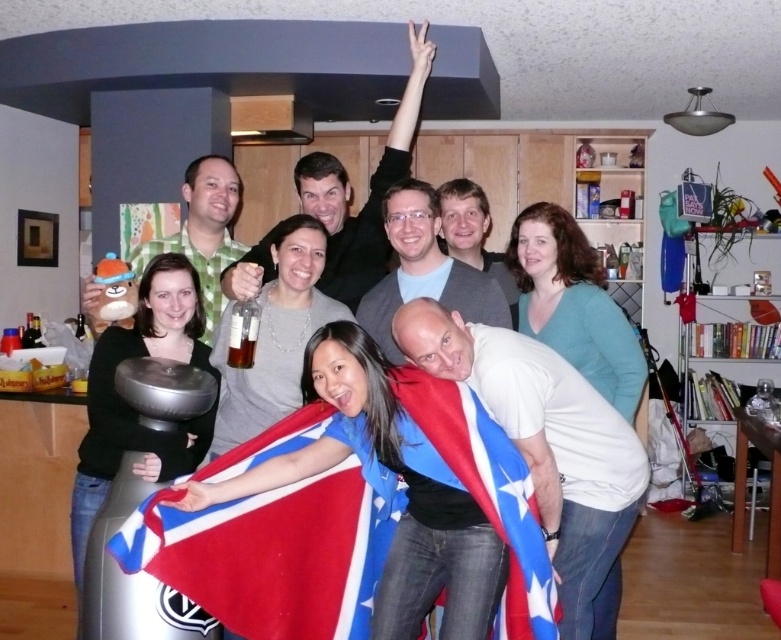
You are a photographer at this gathering and want to capture a photo where both the red fabric flag at center and the matte gray sweater at center are clearly visible. However, the flag is currently blocking part of the sweater. How should you adjust your position to ensure both are visible without any obstruction?

Move to a position where you can see around the red fabric flag at center, which is in front of the matte gray sweater at center. By angling your camera slightly to the side, you can capture both objects without the flag obstructing the sweater.

You are a photographer at the event and need to capture a photo that includes both the matte black shirt at upper center and the translucent glass bottle at center. Based on their positions, which object should you position on the left side of your frame?

The translucent glass bottle at center should be positioned on the left side of the frame since the matte black shirt at upper center is to the right of it.